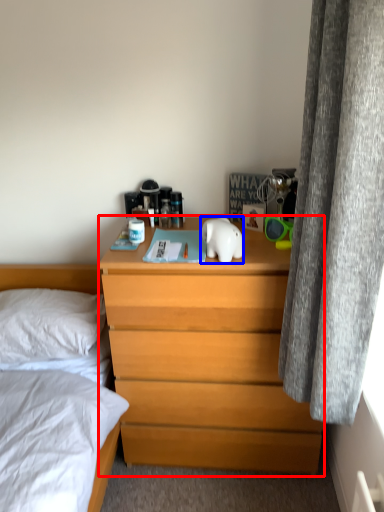
Question: Which point is further to the camera, chest of drawers (highlighted by a red box) or animal (highlighted by a blue box)?

Choices:
 (A) chest of drawers
 (B) animal

Answer: (A)